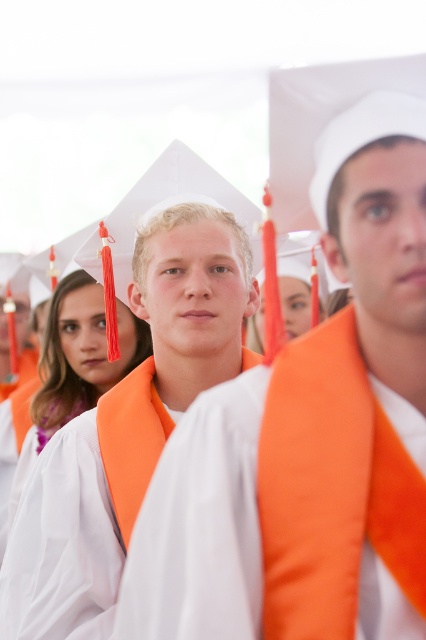
Between point (313, 388) and point (108, 445), which one is positioned in front?

Point (313, 388) is in front.

Which is more to the left, matte orange graduation gown at center or white matte graduation gown at center?

white matte graduation gown at center is more to the left.

Identify the location of matte orange graduation gown at center. The width and height of the screenshot is (426, 640). (307, 435).